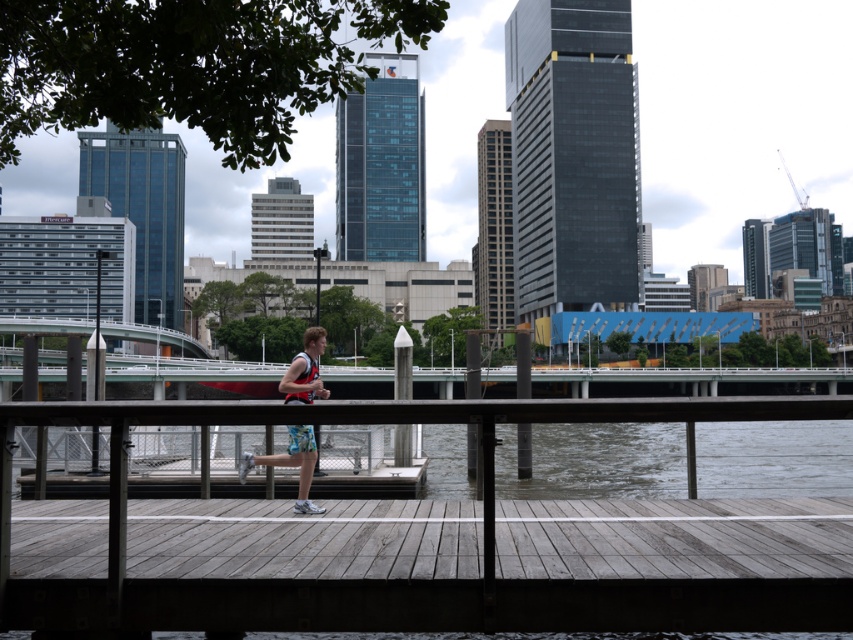
Question: Can you confirm if wooden dock at center is bigger than floral shorts at center?

Choices:
 (A) yes
 (B) no

Answer: (B)

Question: Among these objects, which one is farthest from the camera?

Choices:
 (A) floral shorts at center
 (B) wooden dock at center

Answer: (A)

Question: Does wooden dock at center appear under floral shorts at center?

Choices:
 (A) no
 (B) yes

Answer: (A)

Question: Does wooden dock at center have a larger size compared to floral shorts at center?

Choices:
 (A) yes
 (B) no

Answer: (B)